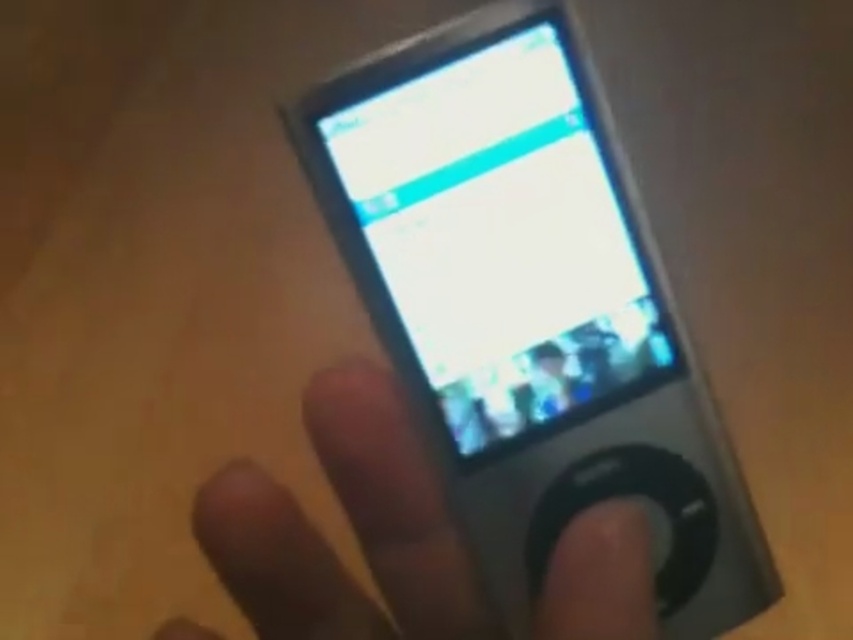
Is point (492, 204) closer to viewer compared to point (625, 611)?

No, it is not.

Locate an element on the screen. The image size is (853, 640). satin silver ipod at center is located at coordinates (529, 305).

Is point (660, 381) more distant than point (381, 476)?

Yes, it is.

This screenshot has height=640, width=853. Find the location of `satin silver ipod at center`. satin silver ipod at center is located at coordinates (529, 305).